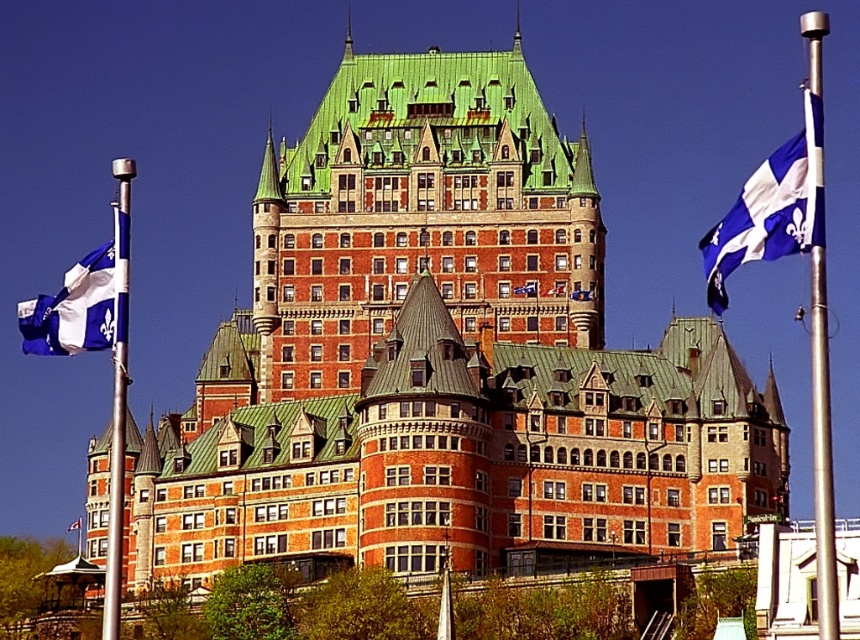
You are a guest at a historical event and notice two flags displayed on the building. The flags are the blue and white fabric flag at right and the blue fabric flag at upper left. Which flag is bigger?

The blue and white fabric flag at right is larger in size than the blue fabric flag at upper left.

You are standing in front of the grand historic building and notice two blue and white fabric flags. Which flag is closer to you, the blue and white fabric flag at right or the blue and white fabric flag at left?

The blue and white fabric flag at right is closer to the viewer than the blue and white fabric flag at left.